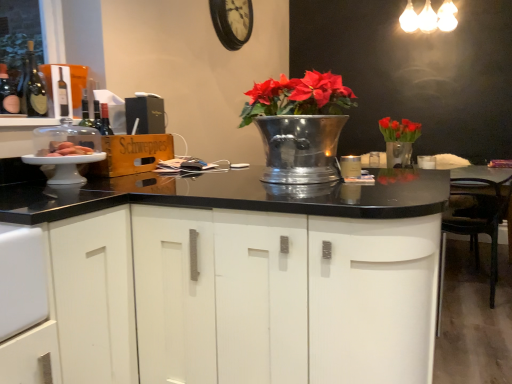
Question: Is matte black wine bottle at left to the right of matte black wine bottle at left from the viewer's perspective?

Choices:
 (A) yes
 (B) no

Answer: (A)

Question: Can you confirm if matte black wine bottle at left is smaller than matte black wine bottle at left?

Choices:
 (A) no
 (B) yes

Answer: (B)

Question: Is matte black wine bottle at left positioned before matte black wine bottle at left?

Choices:
 (A) yes
 (B) no

Answer: (A)

Question: Can you confirm if matte black wine bottle at left is wider than matte black wine bottle at left?

Choices:
 (A) no
 (B) yes

Answer: (B)

Question: Is matte black wine bottle at left bigger than matte black wine bottle at left?

Choices:
 (A) yes
 (B) no

Answer: (B)

Question: Could you tell me if matte black wine bottle at left is turned towards matte black wine bottle at left?

Choices:
 (A) no
 (B) yes

Answer: (A)

Question: Is white matte cabinet at center surrounding matte white cake at left?

Choices:
 (A) no
 (B) yes

Answer: (A)

Question: Is the depth of white matte cabinet at center less than that of matte white cake at left?

Choices:
 (A) no
 (B) yes

Answer: (B)

Question: From a real-world perspective, is white matte cabinet at center located beneath matte white cake at left?

Choices:
 (A) yes
 (B) no

Answer: (A)

Question: Considering the relative positions of white matte cabinet at center and matte white cake at left in the image provided, is white matte cabinet at center to the left of matte white cake at left from the viewer's perspective?

Choices:
 (A) no
 (B) yes

Answer: (A)

Question: Is white matte cabinet at center smaller than matte white cake at left?

Choices:
 (A) yes
 (B) no

Answer: (B)

Question: From the image's perspective, would you say white matte cabinet at center is shown under matte white cake at left?

Choices:
 (A) yes
 (B) no

Answer: (A)

Question: Does metallic silver vase at center have a larger size compared to black leather chair at right?

Choices:
 (A) no
 (B) yes

Answer: (A)